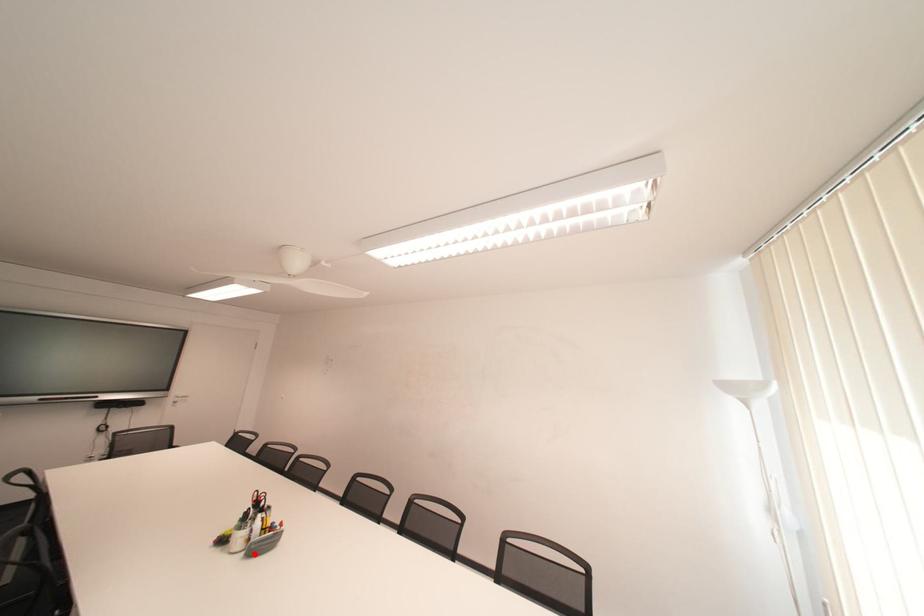
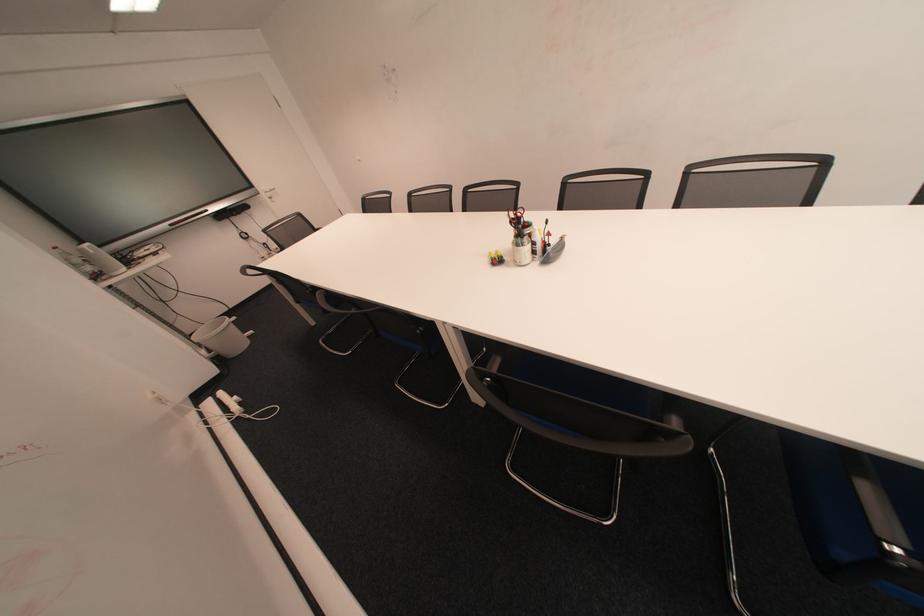
Where in the second image is the point corresponding to the highlighted location from the first image?

(550, 262)